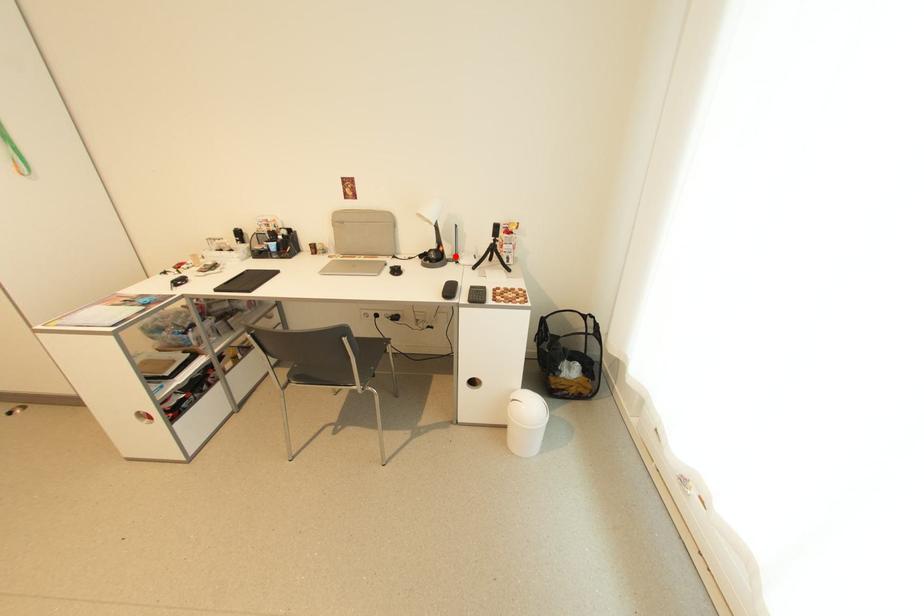
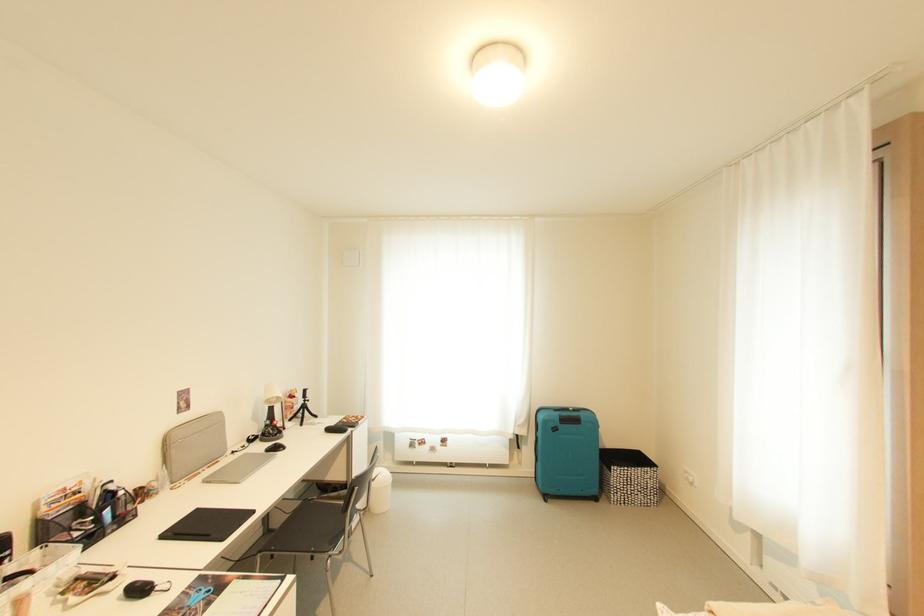
In the second image, find the point that corresponds to the highlighted location in the first image.

(262, 434)